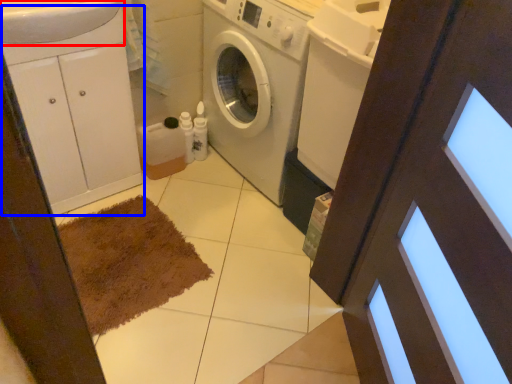
Question: Which point is closer to the camera, sink (highlighted by a red box) or cabinetry (highlighted by a blue box)?

Choices:
 (A) sink
 (B) cabinetry

Answer: (A)